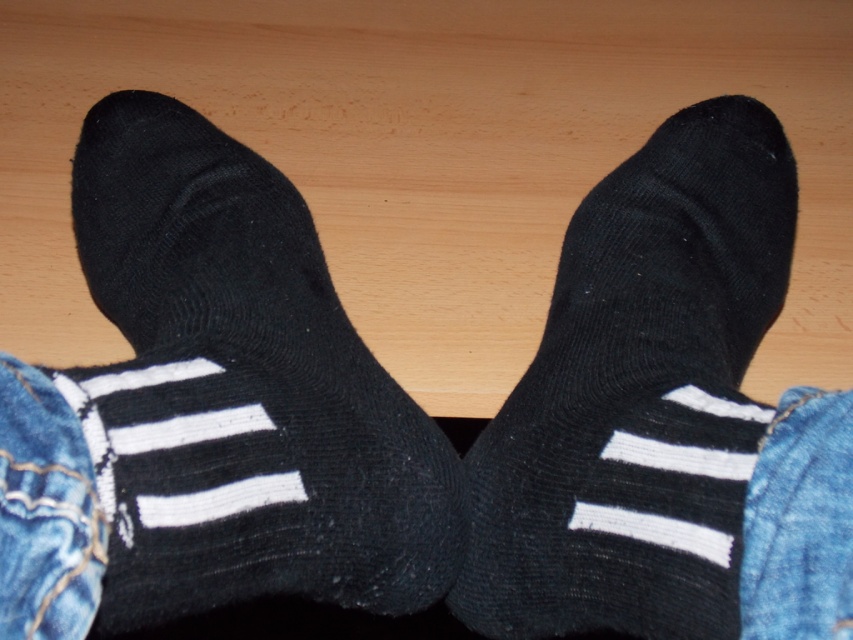
You are trying to decide which leg to move first based on the height of the denim at lower right and jeans at lower left. Which leg has clothing that is shorter?

The denim at lower right is not as tall as jeans at lower left, so the denim at lower right is shorter.